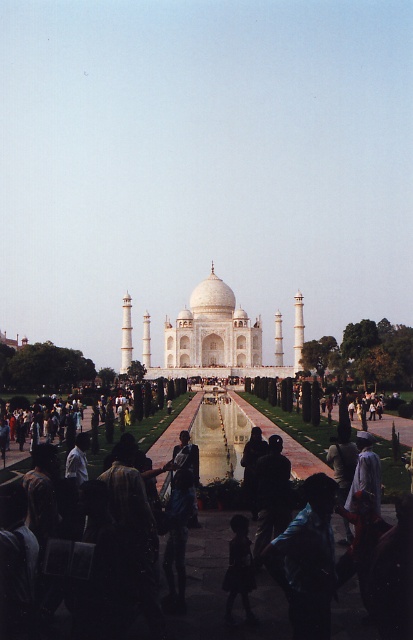
You are standing at the entrance of the Taj Mahal complex and see the white marble taj mahal at center and the black fabric at center. Which object is positioned higher relative to the other?

The white marble taj mahal at center is located above the black fabric at center, so it is positioned higher.

You are a tourist standing at the entrance of the Taj Mahal complex. You see the white marble taj mahal at center and the black fabric at center. Which object is wider?

The white marble taj mahal at center is wider than the black fabric at center.

You are a tourist standing at the entrance of the Taj Mahal complex and see the white marble taj mahal at center and the black fabric at center. Which object is bigger in size?

The white marble taj mahal at center is larger in size compared to the black fabric at center.